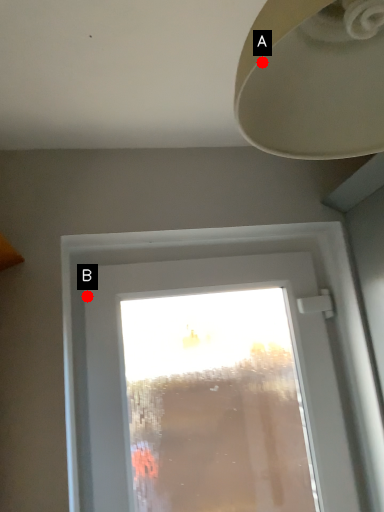
Question: Two points are circled on the image, labeled by A and B beside each circle. Which point is farther to the camera?

Choices:
 (A) A is further
 (B) B is further

Answer: (B)